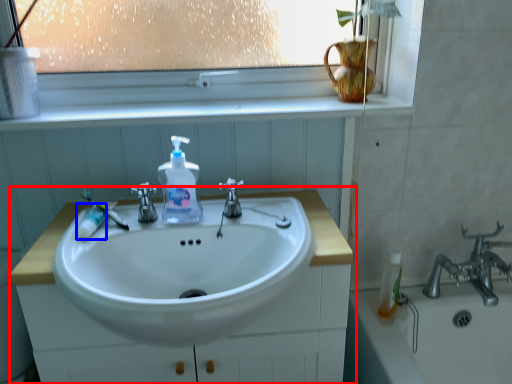
Question: Which point is closer to the camera, bathroom cabinet (highlighted by a red box) or toothpaste (highlighted by a blue box)?

Choices:
 (A) bathroom cabinet
 (B) toothpaste

Answer: (A)